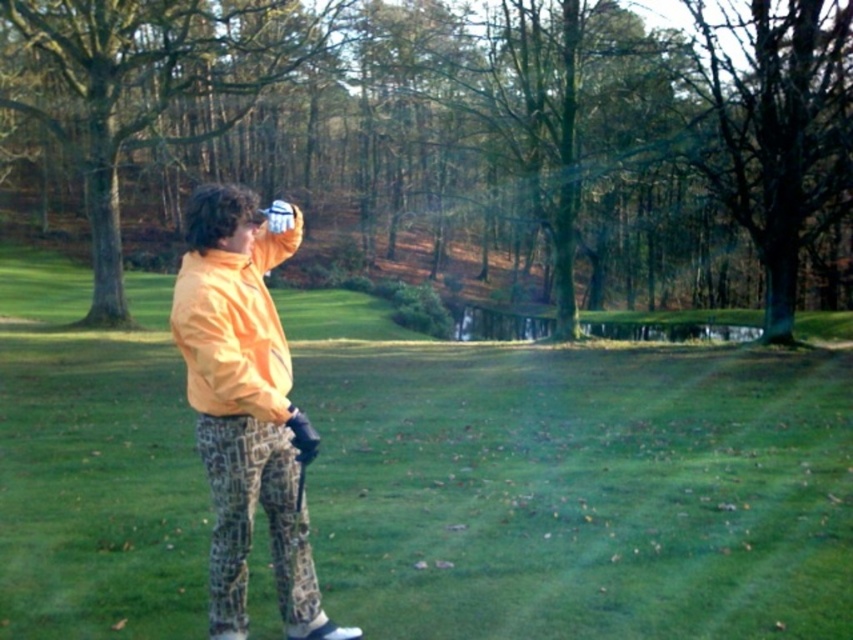
You are a photographer trying to capture a closeup of the orange fabric jacket at center and the green leafy tree at left in the same frame. Which object will appear larger in your photo?

The orange fabric jacket at center will appear larger in the photo because it is closer to the viewer than the green leafy tree at left.

You are a golfer standing on the green grass at center. You want to hit a ball towards the green leafy tree at left. Considering the size difference between the two, which one would appear closer to you when you aim?

The green grass at center appears smaller than the green leafy tree at left, so the green grass at center is closer to you.

You are a golfer who wants to place your orange fabric jacket at center on the green grass at center. Will the jacket completely cover the grass when placed there?

The green grass at center has a larger size compared to orange fabric jacket at center, so the jacket will not completely cover the grass when placed there.